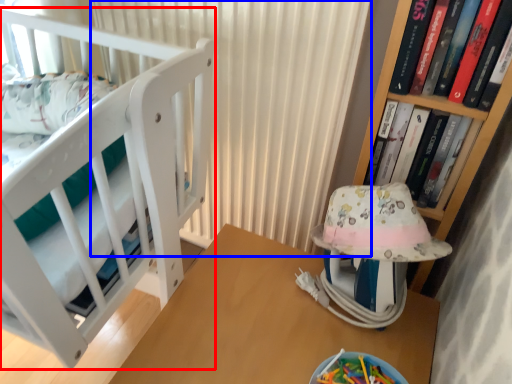
Question: Which object is closer to the camera taking this photo, furniture (highlighted by a red box) or curtain (highlighted by a blue box)?

Choices:
 (A) furniture
 (B) curtain

Answer: (A)